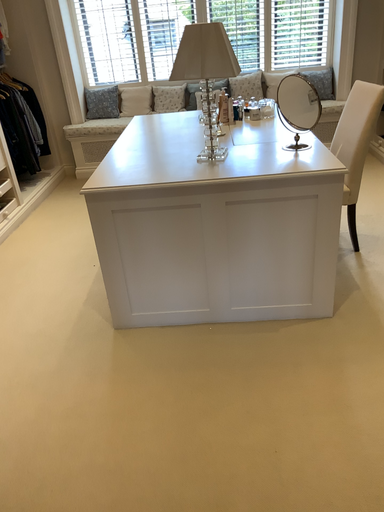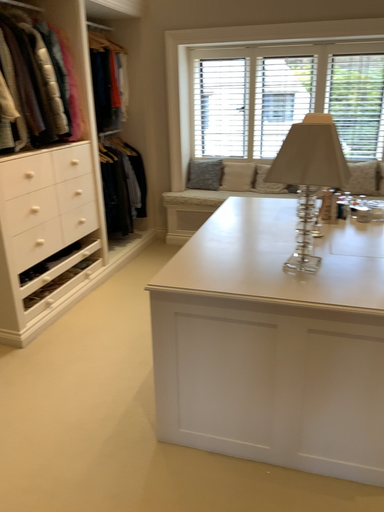
Question: Which way did the camera rotate in the video?

Choices:
 (A) rotated upward
 (B) rotated downward

Answer: (A)